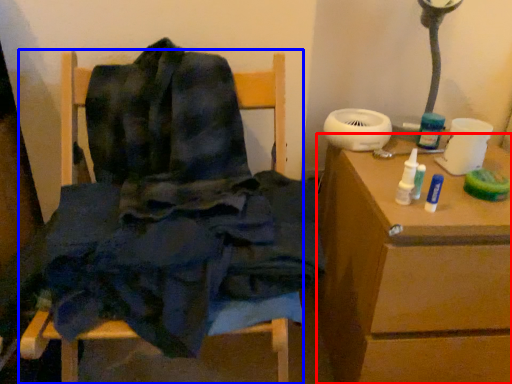
Question: Which point is further to the camera, table (highlighted by a red box) or furniture (highlighted by a blue box)?

Choices:
 (A) table
 (B) furniture

Answer: (A)